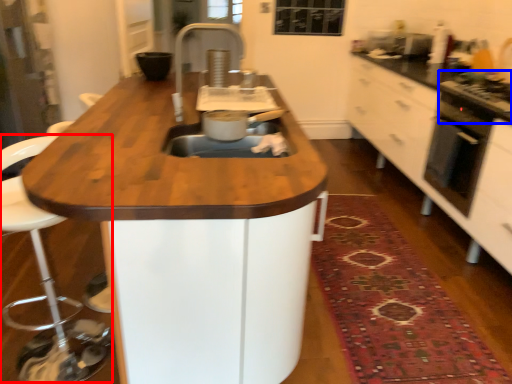
Question: Which of the following is the closest to the observer, swivel chair (highlighted by a red box) or gas stove (highlighted by a blue box)?

Choices:
 (A) swivel chair
 (B) gas stove

Answer: (A)